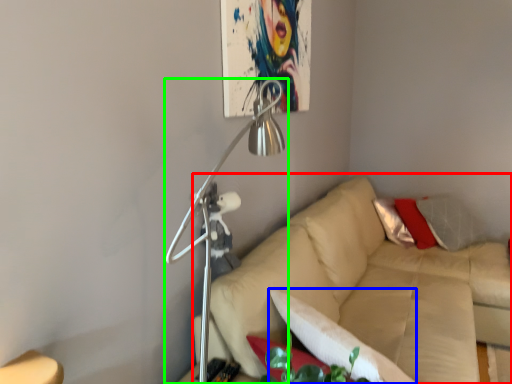
Question: Which object is the closest to the studio couch (highlighted by a red box)? Choose among these: pillow (highlighted by a blue box) or lamp (highlighted by a green box).

Choices:
 (A) pillow
 (B) lamp

Answer: (A)